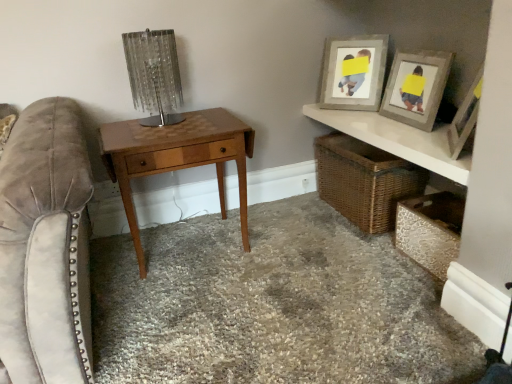
Find the location of a particular element. Image resolution: width=512 pixels, height=384 pixels. vacant region in front of clear glass table lamp at upper left is located at coordinates (159, 135).